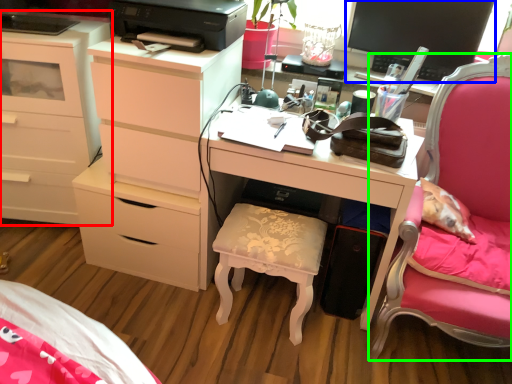
Question: Considering the real-world distances, which object is farthest from chest of drawers (highlighted by a red box)? computer monitor (highlighted by a blue box) or furniture (highlighted by a green box)?

Choices:
 (A) computer monitor
 (B) furniture

Answer: (B)